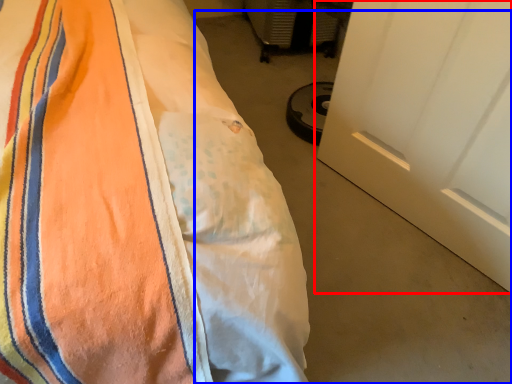
Question: Among these objects, which one is farthest to the camera, door (highlighted by a red box) or concrete (highlighted by a blue box)?

Choices:
 (A) door
 (B) concrete

Answer: (B)